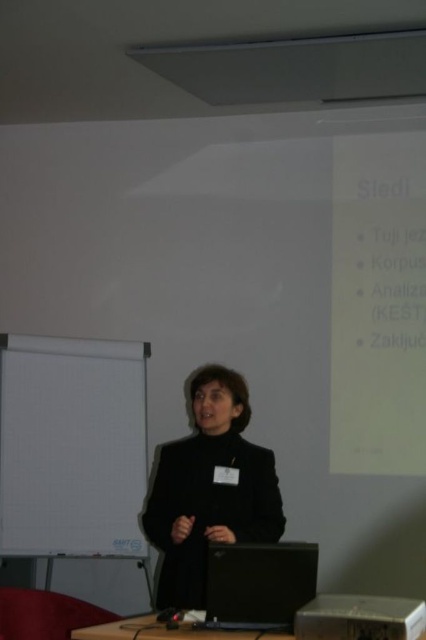
You are an event organizer who needs to ensure that the black matte jacket at center and the black plastic laptop at lower center are visible to the audience. Based on their positions and sizes, which object might block the view of the other? Please explain your reasoning.

The black matte jacket at center is taller than the black plastic laptop at lower center. Since the jacket is taller, it could potentially block the view of the laptop if positioned between the speaker and the audience. However, since the speaker is standing in front of the whiteboard and the laptop is at lower center, the jacket might not directly obstruct the laptop unless the speaker moves closer. The main concern would be ensuring the laptop isn

You are a student who needs to place a notebook on the white paper at center and the black plastic table at lower center. Which surface can you place it on without it hanging off the edge?

The white paper at center is much taller than the black plastic table at lower center, so the notebook can be placed on the white paper at center without hanging off the edge.

You are an attendee at a conference and see the white paper at center and the black matte jacket at center. Which object is closer to you?

The white paper at center is closer to you because the black matte jacket at center is behind it.